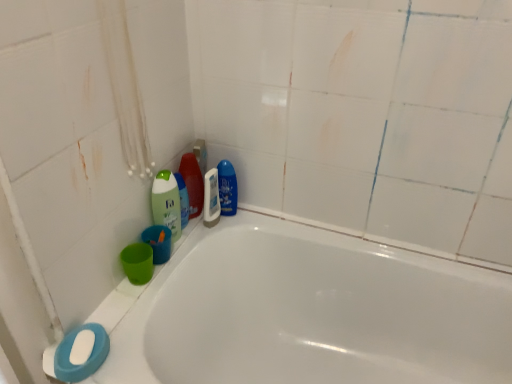
Locate an element on the screen. This screenshot has height=384, width=512. vacant space in front of green matte bottle at upper left, the third cleaning product viewed from the right is located at coordinates (175, 258).